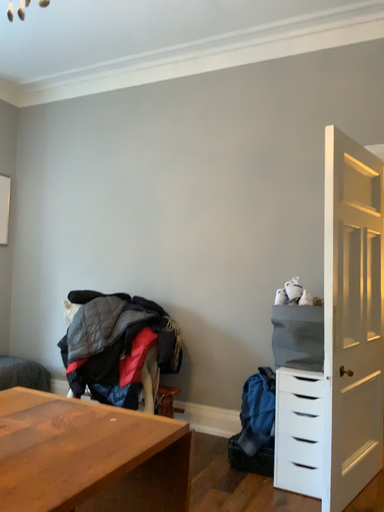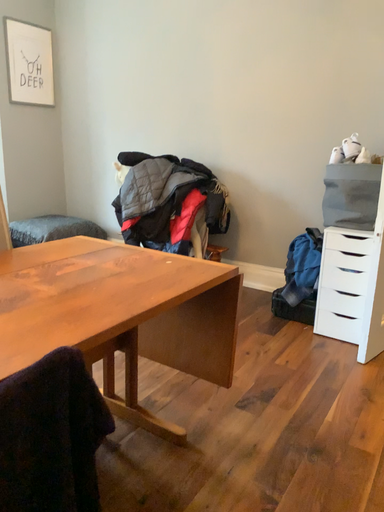
Question: Which way did the camera rotate in the video?

Choices:
 (A) rotated downward
 (B) rotated upward

Answer: (A)